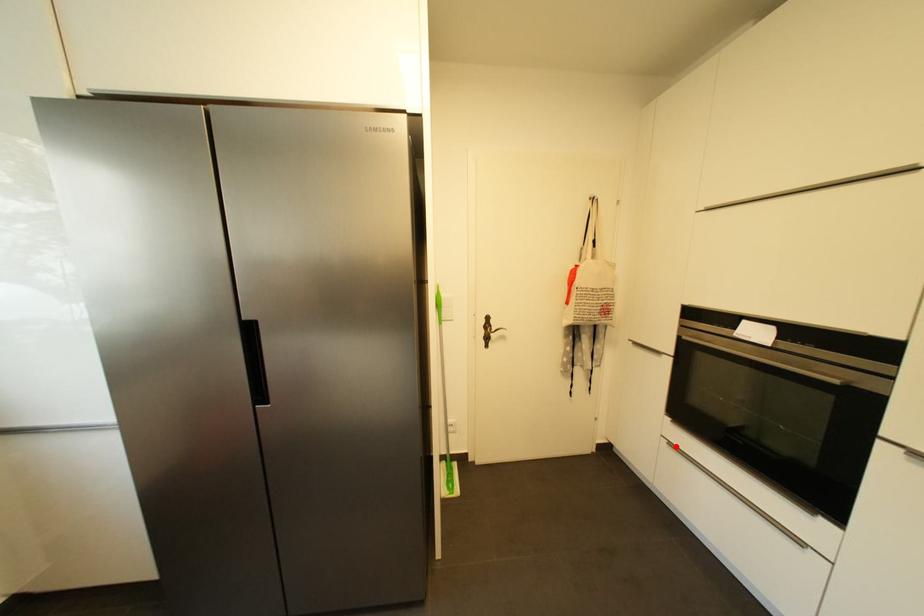
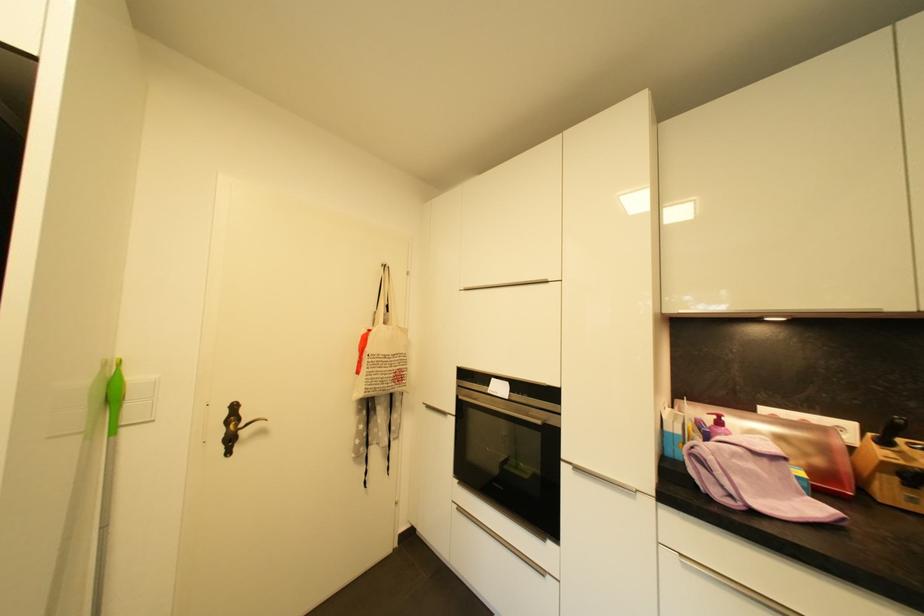
Where in the second image is the point corresponding to the highlighted location from the first image?

(465, 511)